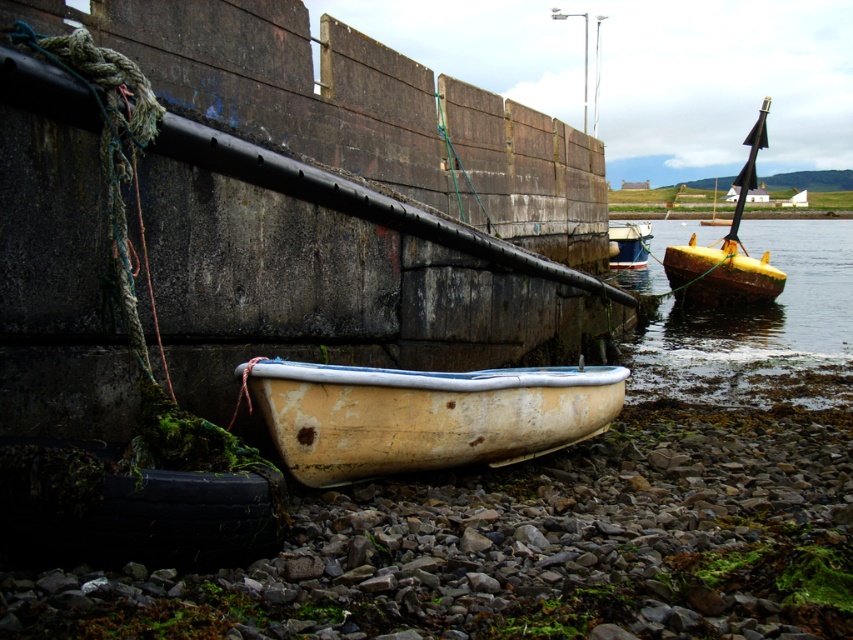
You are a marine biologist studying boat sizes in coastal areas. You observe a yellow wooden boat at right and a white plastic boat at center. Which boat has a smaller length?

The yellow wooden boat at right is shorter than the white plastic boat at center, so the yellow wooden boat at right has a smaller length.

You are standing at the point marked by the coordinates point [424,413] in the image. What object are you directly facing?

The point [424,413] indicates rusty wood boat at lower center, so you are directly facing the rusty wood boat at lower center.

You are standing at the edge of the rocky shore looking at the rowboat and the stone wall. There are two points marked on the image. Which point, point (x=735, y=216) or point (x=631, y=256), is closer to you?

Point (x=735, y=216) is closer to the viewer than point (x=631, y=256).